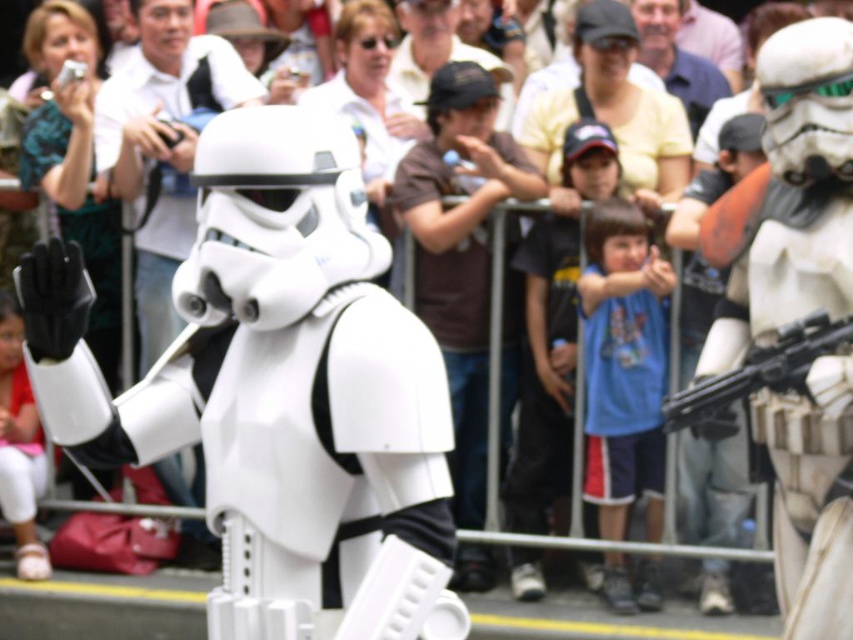
You are a photographer at the event and want to capture the white matte stormtrooper at center. You notice a point at coordinates (270, 376). Is this point located on the white matte stormtrooper at center?

Yes, the point at coordinates (270, 376) is located on the white matte stormtrooper at center as stated in the objects description.

You are a photographer at the event and need to capture both the white matte stormtrooper at center and the white matte helmet at center in a single frame. Based on their heights, which one will appear larger in the photo?

The white matte helmet at center will appear larger in the photo because it is taller than the white matte stormtrooper at center.